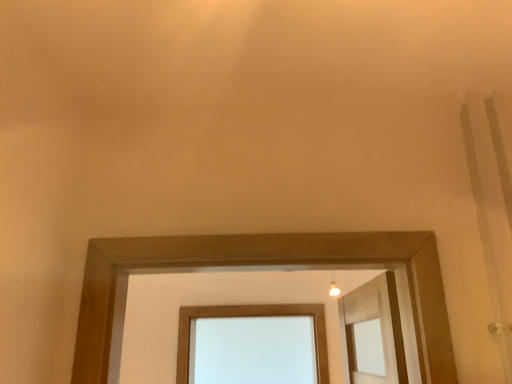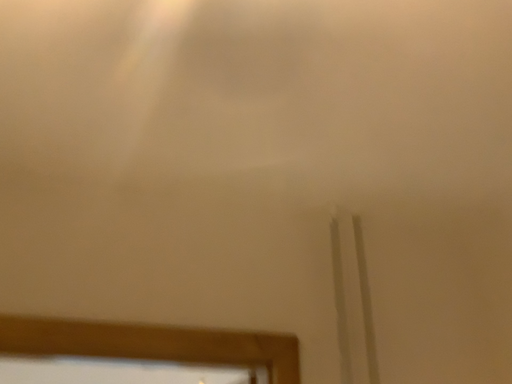
Question: How did the camera likely rotate when shooting the video?

Choices:
 (A) rotated left
 (B) rotated right

Answer: (B)